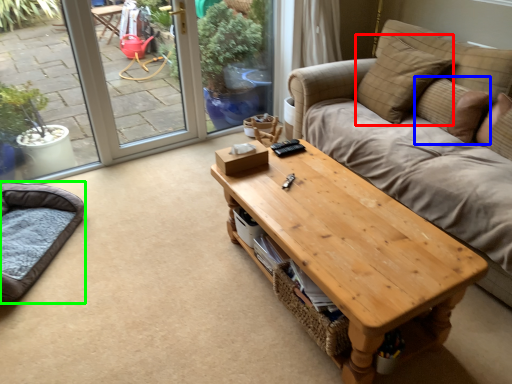
Question: Which is farther away from pillow (highlighted by a red box)? pillow (highlighted by a blue box) or cat bed (highlighted by a green box)?

Choices:
 (A) pillow
 (B) cat bed

Answer: (B)